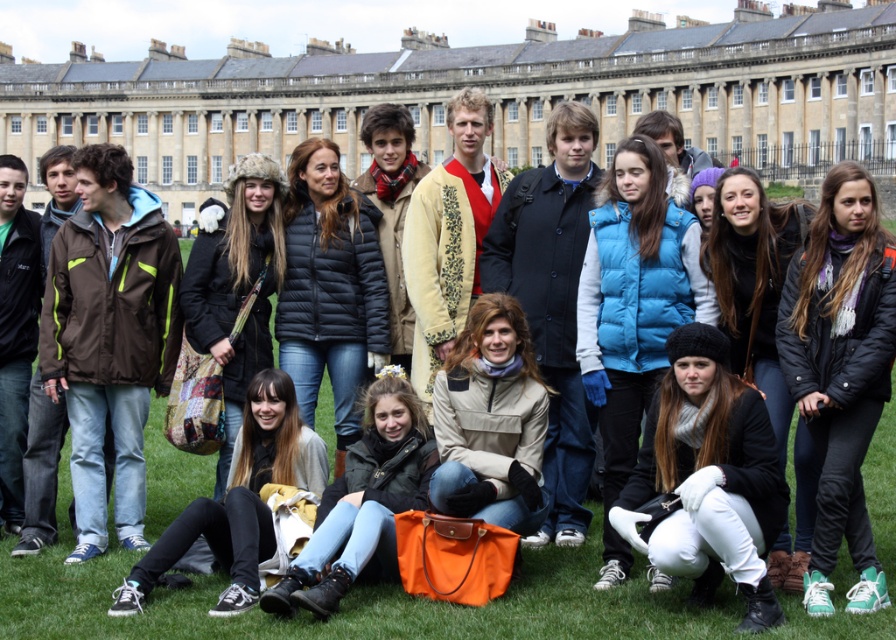
In the scene shown: You are standing at the point with coordinates point at (484, 90) in the image. What object are you facing?

You are facing the smooth stone palace at center, as the point at (484, 90) corresponds to it.

You are a photographer trying to capture a clear shot of the blue puffy vest at center without the smooth stone palace at center blocking it. What adjustment should you make to your camera position?

The blue puffy vest at center is behind the smooth stone palace at center, so you should move your camera position forward to get a clear shot of the blue puffy vest at center without obstruction.